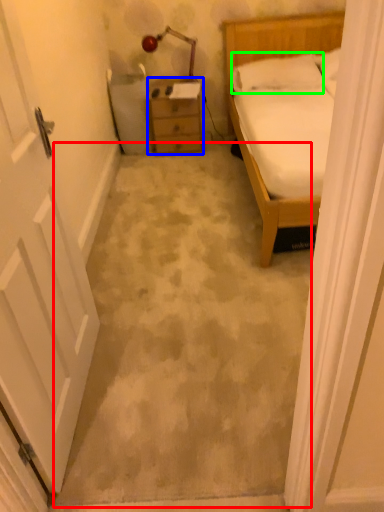
Question: Estimate the real-world distances between objects in this image. Which object is farther from concrete (highlighted by a red box), chest of drawers (highlighted by a blue box) or pillow (highlighted by a green box)?

Choices:
 (A) chest of drawers
 (B) pillow

Answer: (B)